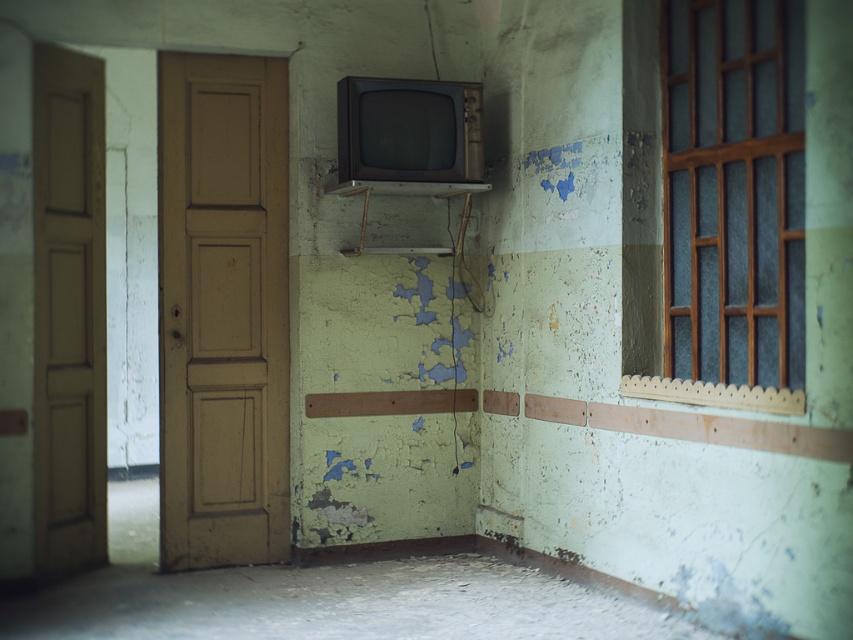
Question: Can you confirm if brown wooden door at left is positioned below peeling paint crack at center?

Choices:
 (A) no
 (B) yes

Answer: (A)

Question: Which of the following is the closest to the observer?

Choices:
 (A) (462, 225)
 (B) (82, 333)
 (C) (724, 250)

Answer: (C)

Question: Is wooden-framed glass at upper right positioned in front of peeling paint crack at center?

Choices:
 (A) yes
 (B) no

Answer: (A)

Question: Which point is closer to the camera?

Choices:
 (A) (460, 220)
 (B) (747, 48)

Answer: (B)

Question: Is wooden-framed glass at upper right above brown wooden door at left?

Choices:
 (A) yes
 (B) no

Answer: (A)

Question: Estimate the real-world distances between objects in this image. Which object is farther from the peeling paint crack at center?

Choices:
 (A) brown wooden door at left
 (B) brown matte door at left

Answer: (A)